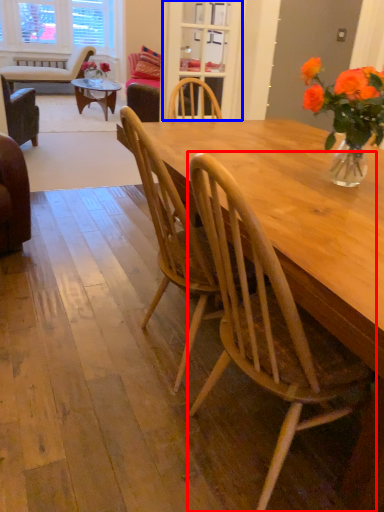
Question: Among these objects, which one is nearest to the camera, chair (highlighted by a red box) or glass door (highlighted by a blue box)?

Choices:
 (A) chair
 (B) glass door

Answer: (A)